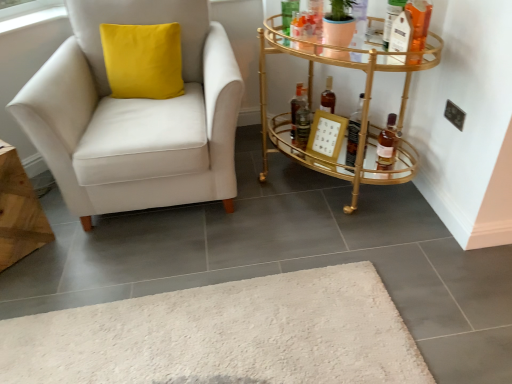
Question: From a real-world perspective, is translucent glass bottle at right, which ranks as the third bottle in left-to-right order, positioned above or below shiny dark brown bottle at center, acting as the 3th bottle starting from the right?

Choices:
 (A) above
 (B) below

Answer: (B)

Question: In terms of size, does translucent glass bottle at right, which appears as the 1th bottle when viewed from the right, appear bigger or smaller than shiny dark brown bottle at center, the 1th bottle positioned from the left?

Choices:
 (A) big
 (B) small

Answer: (A)

Question: Based on their relative distances, which object is farther from the translucent glass bottle at right, which appears as the 1th bottle when viewed from the right?

Choices:
 (A) gold metallic picture frame at center right
 (B) shiny dark brown bottle at center, acting as the 3th bottle starting from the right
 (C) white fabric chair at left
 (D) gold metallic bar cart at right
 (E) translucent glass bottle at right, the second bottle when ordered from right to left

Answer: (C)

Question: Which object is positioned closest to the translucent glass bottle at right, which ranks as the third bottle in left-to-right order?

Choices:
 (A) translucent glass bottle at right, the 2th bottle viewed from the left
 (B) gold metallic bar cart at right
 (C) white fabric chair at left
 (D) shiny dark brown bottle at center, the 1th bottle positioned from the left
 (E) gold metallic picture frame at center right

Answer: (A)